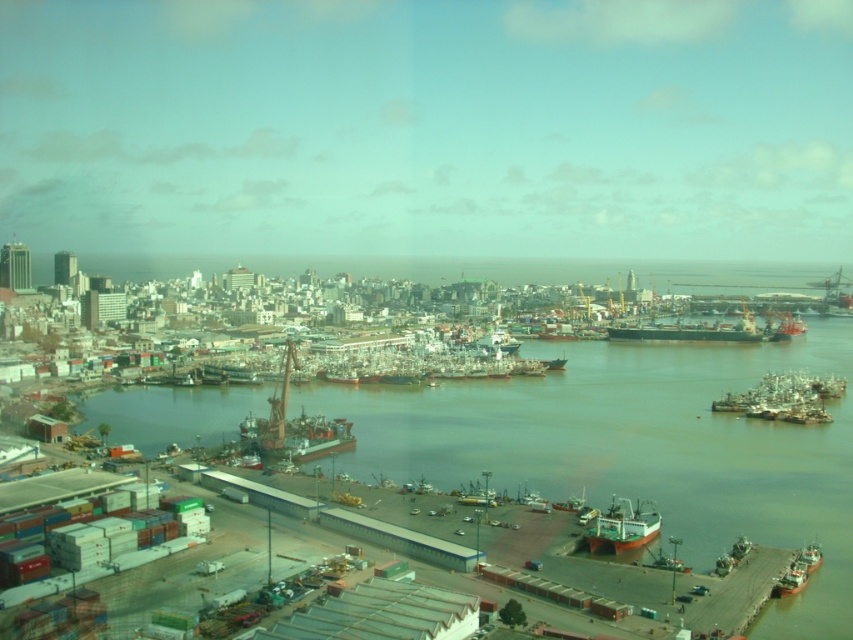
Question: Among these objects, which one is nearest to the camera?

Choices:
 (A) smooth concrete dock at lower right
 (B) brown matte ship at lower right

Answer: (A)

Question: Is brown matte ship at lower right smaller than green matte boat at center?

Choices:
 (A) no
 (B) yes

Answer: (A)

Question: Does metallic gray ship at lower right appear on the left side of reddish-orange wooden boat at center-right?

Choices:
 (A) yes
 (B) no

Answer: (A)

Question: Does smooth concrete dock at lower right come in front of reddish-orange wooden boat at center-right?

Choices:
 (A) yes
 (B) no

Answer: (A)

Question: Estimate the real-world distances between objects in this image. Which object is closer to the green matte boat at center?

Choices:
 (A) dark gray metallic ship at center-right
 (B) metallic red boat at center
 (C) orange matte ship at lower right
 (D) reddish-orange wooden boat at center-right

Answer: (A)

Question: Which point is farther to the camera?

Choices:
 (A) reddish-orange wooden boat at center-right
 (B) green matte boat at center
 (C) metallic red boat at center

Answer: (A)